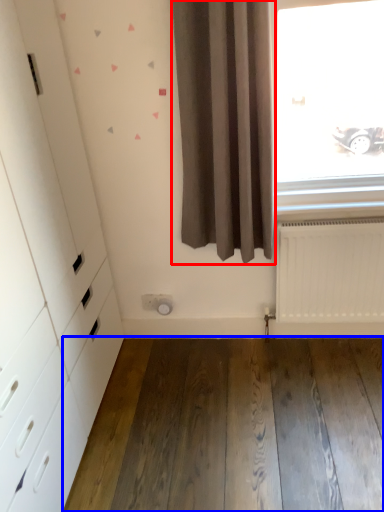
Question: Among these objects, which one is farthest to the camera, curtain (highlighted by a red box) or hardwood (highlighted by a blue box)?

Choices:
 (A) curtain
 (B) hardwood

Answer: (B)